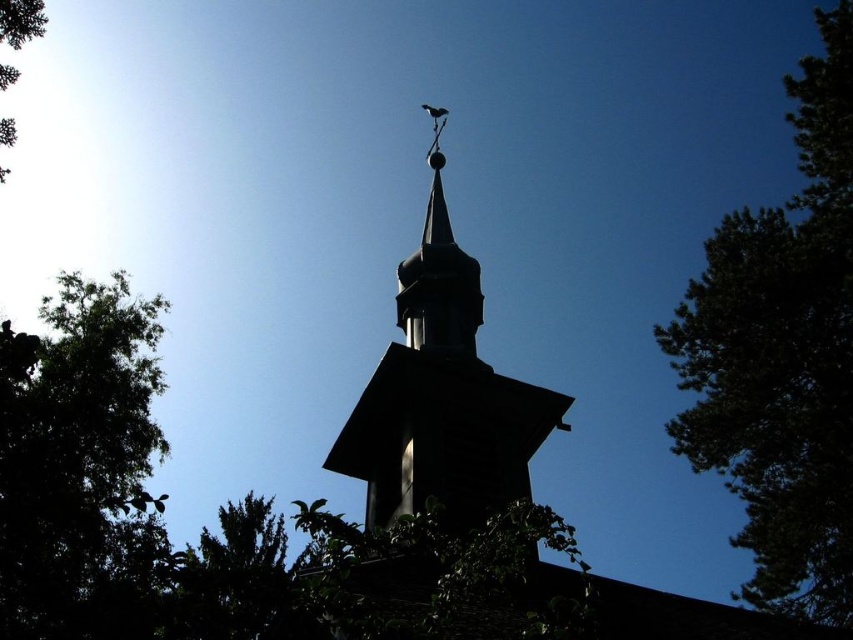
You are standing in a field looking at the church steeple and the tree. If you want to take a photo where the black wood steeple at center is in focus, should you adjust your camera to focus on something closer or farther than the green leafy tree at lower left?

The green leafy tree at lower left is closer to the viewer than the black wood steeple at center. To focus on the black wood steeple at center, you should adjust your camera to focus on something farther than the green leafy tree at lower left.

You are a bird flying over the church steeple. You see a point marked at coordinates point [782,355]. Can you tell me what object this point is located on?

The point [782,355] is located on the green leafy tree at upper right.

You are standing in front of the church steeple and want to take a photo that includes both the green leafy tree at upper right and the green leafy tree at upper left. Which tree should you move closer to in order to capture both in the frame?

You should move closer to the green leafy tree at upper left because it is farther away from you compared to the green leafy tree at upper right. By moving closer to the tree that is farther, you can better include both trees in the frame.